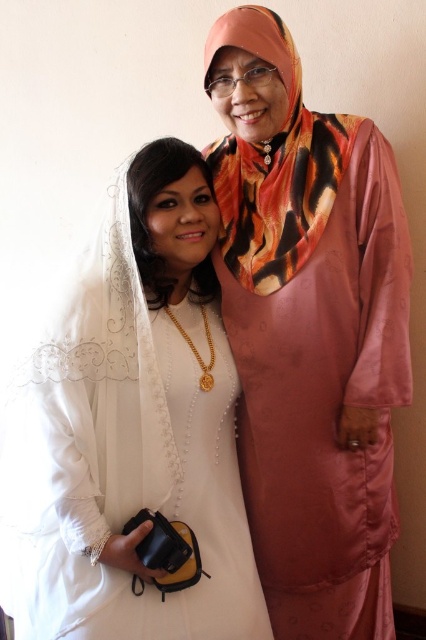
Question: Considering the real-world distances, which object is closest to the matte white dress at center?

Choices:
 (A) silky pink dress at right
 (B) orange tiger print scarf at upper right

Answer: (A)

Question: Considering the real-world distances, which object is farthest from the silky pink dress at right?

Choices:
 (A) matte white dress at center
 (B) orange tiger print scarf at upper right

Answer: (A)

Question: Which of the following is the farthest from the observer?

Choices:
 (A) tap(299, 198)
 (B) tap(100, 436)
 (C) tap(356, 266)

Answer: (A)

Question: Observing the image, what is the correct spatial positioning of silky pink dress at right in reference to orange tiger print scarf at upper right?

Choices:
 (A) below
 (B) above

Answer: (A)

Question: Can you confirm if silky pink dress at right is positioned to the right of matte white dress at center?

Choices:
 (A) yes
 (B) no

Answer: (A)

Question: Does silky pink dress at right have a smaller size compared to orange tiger print scarf at upper right?

Choices:
 (A) yes
 (B) no

Answer: (B)